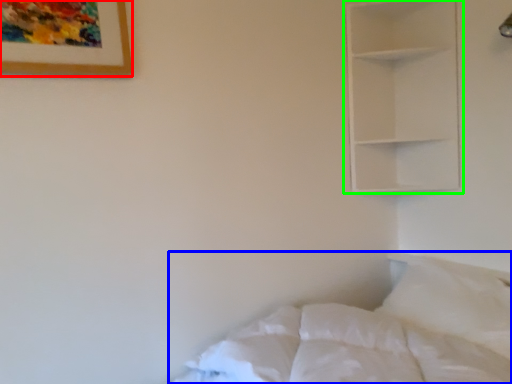
Question: Based on their relative distances, which object is nearer to picture frame (highlighted by a red box)? Choose from bed (highlighted by a blue box) and shelf (highlighted by a green box).

Choices:
 (A) bed
 (B) shelf

Answer: (A)